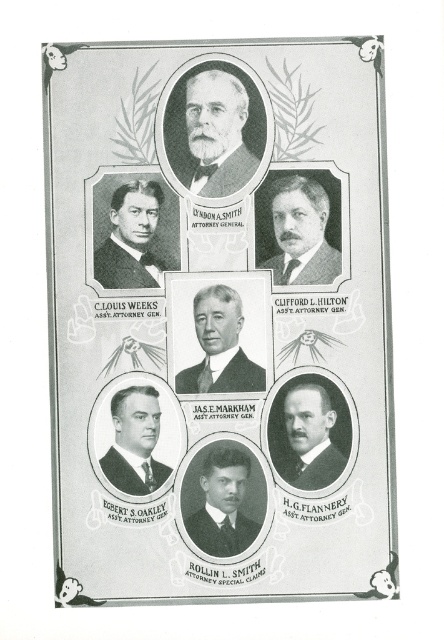
In the scene shown: Can you confirm if smooth gray suit at center is positioned to the right of black suit at left?

Yes, smooth gray suit at center is to the right of black suit at left.

Which is in front, point (229, 385) or point (157, 218)?

Positioned in front is point (229, 385).

Who is more forward, (x=241, y=381) or (x=111, y=280)?

Point (x=241, y=381) is more forward.

At what (x,y) coordinates should I click in order to perform the action: click on smooth gray suit at center. Please return your answer as a coordinate pair (x, y). Image resolution: width=444 pixels, height=640 pixels. Looking at the image, I should click on (219, 346).

You are a GUI agent. You are given a task and a screenshot of the screen. Output one action in this format:
    pyautogui.click(x=<x>, y=<y>)
    Task: Click on the smooth brown suit at center
    This screenshot has height=640, width=444.
    Given the screenshot: What is the action you would take?
    pyautogui.click(x=298, y=230)

Is the position of smooth brown suit at center less distant than that of smooth black suit at center?

No, smooth brown suit at center is further to the viewer.

Between point (297, 195) and point (293, 403), which one is positioned behind?

The point (297, 195) is more distant.

At what (x,y) coordinates should I click in order to perform the action: click on smooth brown suit at center. Please return your answer as a coordinate pair (x, y). Looking at the image, I should click on (298, 230).

Does gray hair and beard at upper center appear on the left side of smooth gray suit at center?

Correct, you'll find gray hair and beard at upper center to the left of smooth gray suit at center.

What do you see at coordinates (210, 132) in the screenshot? I see `gray hair and beard at upper center` at bounding box center [210, 132].

The image size is (444, 640). Find the location of `gray hair and beard at upper center`. gray hair and beard at upper center is located at coordinates (210, 132).